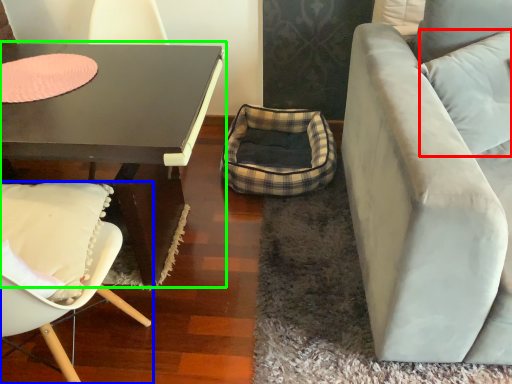
Question: Which object is the farthest from pillow (highlighted by a red box)? Choose among these: chair (highlighted by a blue box) or coffee table (highlighted by a green box).

Choices:
 (A) chair
 (B) coffee table

Answer: (A)